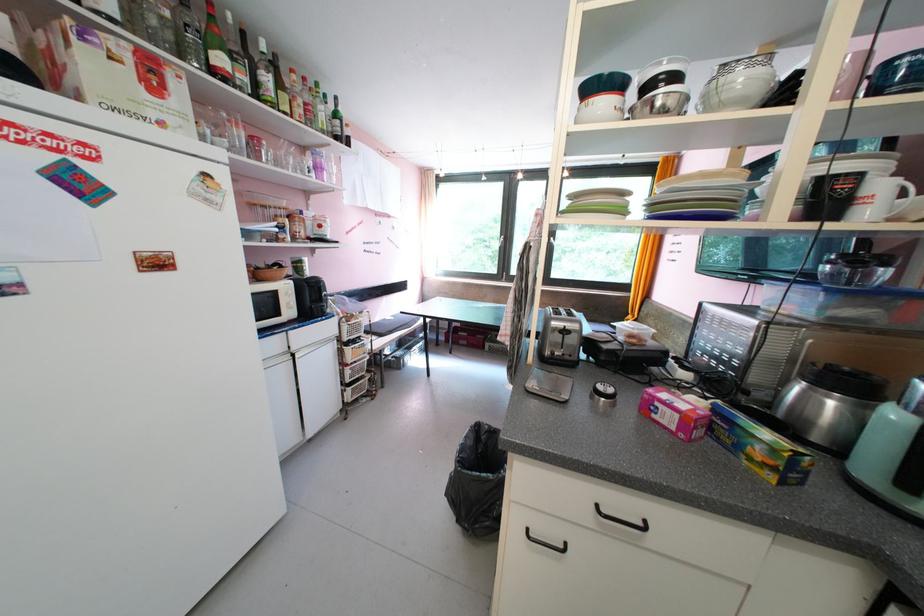
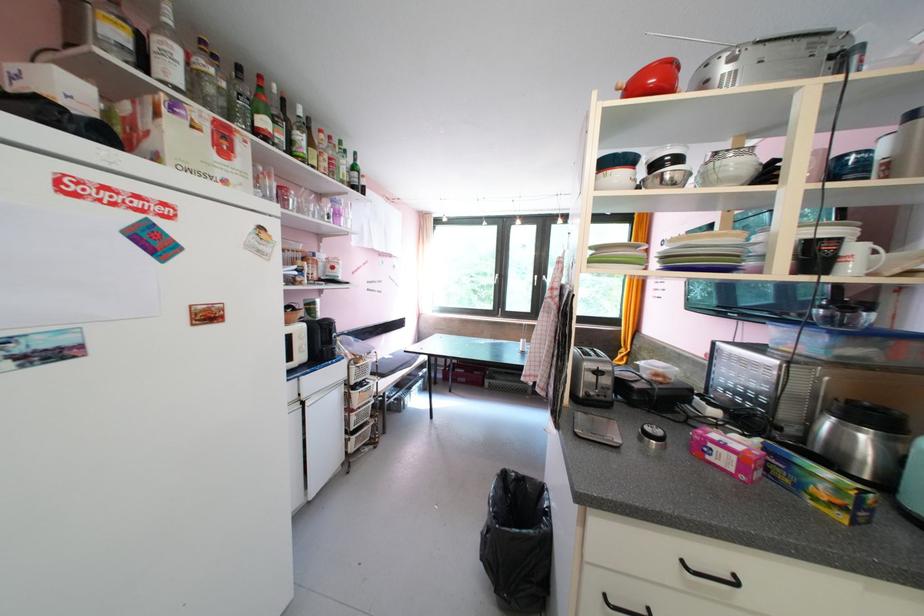
In the second image, find the point that corresponds to point 253,81 in the first image.

(290, 140)